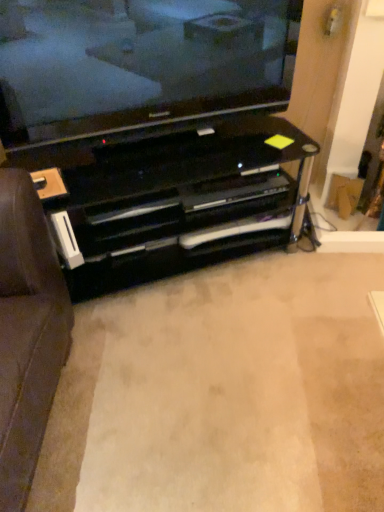
Question: Would you say black glossy tv stand at center is to the left or to the right of black glass television at upper center in the picture?

Choices:
 (A) right
 (B) left

Answer: (A)

Question: From the image's perspective, is black glossy tv stand at center located above or below black glass television at upper center?

Choices:
 (A) above
 (B) below

Answer: (B)

Question: Which of these objects is positioned farthest from the black glossy tv stand at center?

Choices:
 (A) black glossy entertainment center at center
 (B) black glass television at upper center

Answer: (B)

Question: Which object is positioned farthest from the black glossy tv stand at center?

Choices:
 (A) black glossy entertainment center at center
 (B) black glass television at upper center

Answer: (B)